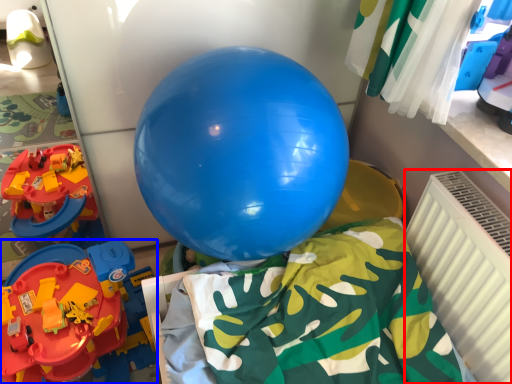
Question: Which object appears closest to the camera in this image, radiator (highlighted by a red box) or toy (highlighted by a blue box)?

Choices:
 (A) radiator
 (B) toy

Answer: (A)